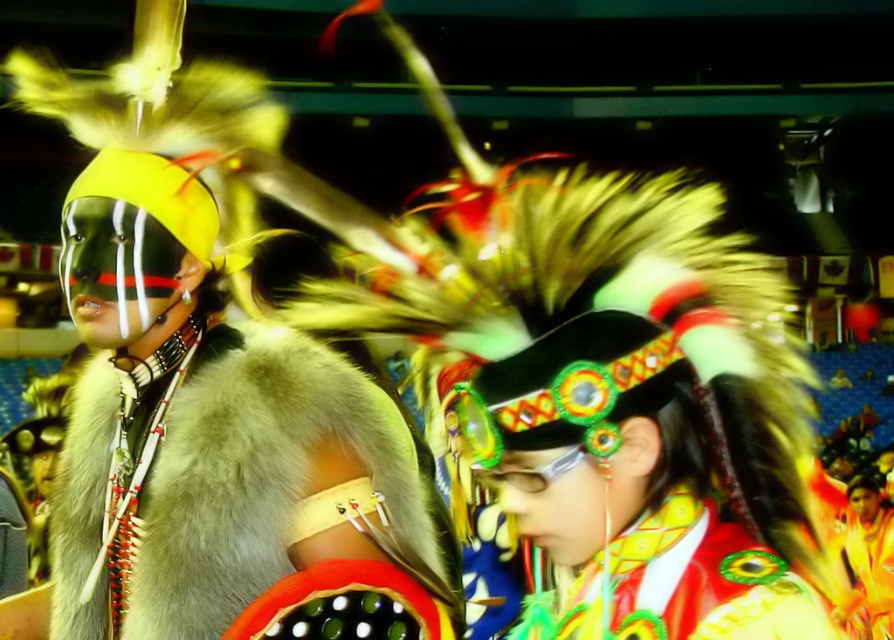
You are an observer at the powwow and notice the fur at left and the shiny yellow fabric headdress at center. Which object is located lower in the image?

The fur at left is positioned under the shiny yellow fabric headdress at center, so it is lower in the image.

You are an artist creating a sketch of the scene. You need to decide which object to draw first based on their size. Which object should you start with, the fur at left or the shiny yellow fabric headdress at center?

The fur at left is thinner than the shiny yellow fabric headdress at center, so you should start with the shiny yellow fabric headdress at center since it is larger.